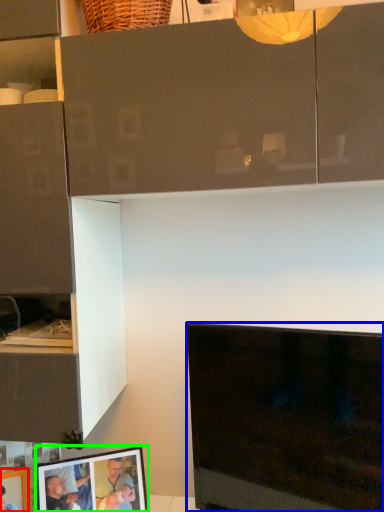
Question: Estimate the real-world distances between objects in this image. Which object is closer to picture frame (highlighted by a red box), television (highlighted by a blue box) or picture frame (highlighted by a green box)?

Choices:
 (A) television
 (B) picture frame

Answer: (B)